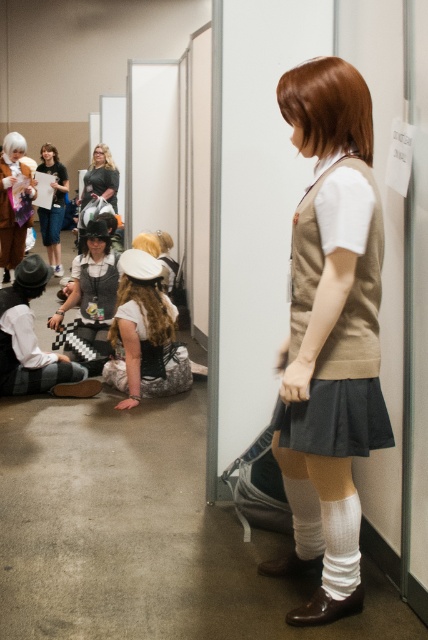
Is point (326, 456) closer to viewer compared to point (100, 193)?

Yes, it is.

Does matte brown vest at center have a lesser width compared to matte black dress at center?

Yes, matte brown vest at center is thinner than matte black dress at center.

Identify the location of matte brown vest at center. Image resolution: width=428 pixels, height=640 pixels. (329, 323).

Does white fabric hat at center have a larger size compared to matte black hat at lower left?

Yes.

Between white fabric hat at center and matte black hat at lower left, which one has less height?

matte black hat at lower left

Locate an element on the screen. white fabric hat at center is located at coordinates coord(143,332).

At what (x,y) coordinates should I click in order to perform the action: click on white fabric hat at center. Please return your answer as a coordinate pair (x, y). This screenshot has height=640, width=428. Looking at the image, I should click on (143, 332).

Who is taller, white fabric hat at center or matte brown coat at left?

Standing taller between the two is matte brown coat at left.

Measure the distance between white fabric hat at center and camera.

white fabric hat at center is 4.12 meters away from camera.

Locate an element on the screen. The image size is (428, 640). white fabric hat at center is located at coordinates point(143,332).